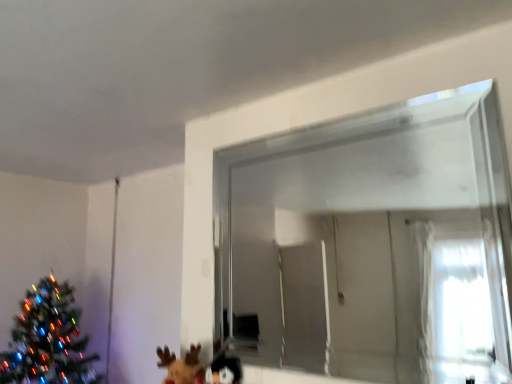
Find the location of a particular element. The image size is (512, 384). transparent glass window at upper center is located at coordinates (370, 244).

Describe the element at coordinates (370, 244) in the screenshot. I see `transparent glass window at upper center` at that location.

Locate an element on the screen. This screenshot has height=384, width=512. transparent glass window at upper center is located at coordinates [x=370, y=244].